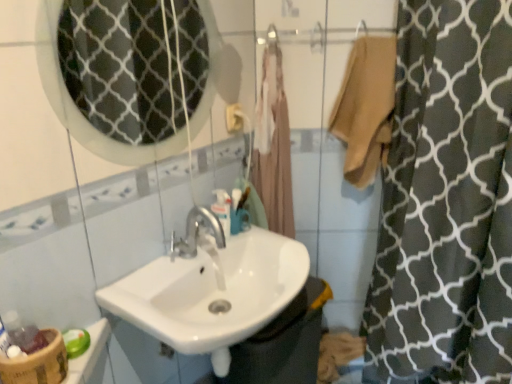
Question: Does beige fabric bathrobe at center lie behind bamboo textured basket at lower left?

Choices:
 (A) no
 (B) yes

Answer: (B)

Question: Is beige fabric bathrobe at center smaller than bamboo textured basket at lower left?

Choices:
 (A) yes
 (B) no

Answer: (B)

Question: Does beige fabric bathrobe at center have a greater width compared to bamboo textured basket at lower left?

Choices:
 (A) no
 (B) yes

Answer: (B)

Question: Does beige fabric bathrobe at center have a lesser width compared to bamboo textured basket at lower left?

Choices:
 (A) yes
 (B) no

Answer: (B)

Question: Is beige fabric bathrobe at center at the right side of bamboo textured basket at lower left?

Choices:
 (A) no
 (B) yes

Answer: (B)

Question: Would you say beige cotton towel at upper right is to the left or to the right of bamboo textured basket at lower left in the picture?

Choices:
 (A) left
 (B) right

Answer: (B)

Question: Do you think beige cotton towel at upper right is within bamboo textured basket at lower left, or outside of it?

Choices:
 (A) outside
 (B) inside

Answer: (A)

Question: From a real-world perspective, is beige cotton towel at upper right above or below bamboo textured basket at lower left?

Choices:
 (A) below
 (B) above

Answer: (B)

Question: Considering their positions, is beige cotton towel at upper right located in front of or behind bamboo textured basket at lower left?

Choices:
 (A) front
 (B) behind

Answer: (B)

Question: Do you think beige fabric bathrobe at center is within white glossy sink at center, or outside of it?

Choices:
 (A) inside
 (B) outside

Answer: (B)

Question: From a real-world perspective, is beige fabric bathrobe at center above or below white glossy sink at center?

Choices:
 (A) below
 (B) above

Answer: (B)

Question: Considering their positions, is beige fabric bathrobe at center located in front of or behind white glossy sink at center?

Choices:
 (A) behind
 (B) front

Answer: (A)

Question: Is beige fabric bathrobe at center taller or shorter than white glossy sink at center?

Choices:
 (A) tall
 (B) short

Answer: (A)

Question: Is point (224, 192) closer or farther from the camera than point (134, 291)?

Choices:
 (A) farther
 (B) closer

Answer: (A)

Question: In terms of height, does translucent plastic mouthwash at center look taller or shorter compared to white glossy sink at center?

Choices:
 (A) tall
 (B) short

Answer: (B)